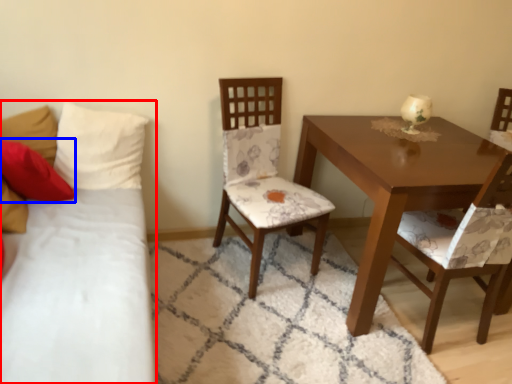
Question: Which of the following is the closest to the observer, studio couch (highlighted by a red box) or pillow (highlighted by a blue box)?

Choices:
 (A) studio couch
 (B) pillow

Answer: (A)